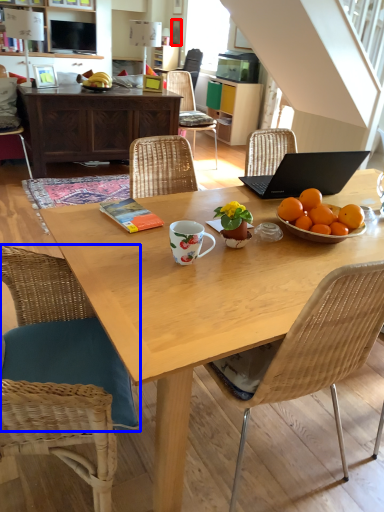
Question: Which object is closer to the camera taking this photo, picture frame (highlighted by a red box) or chair (highlighted by a blue box)?

Choices:
 (A) picture frame
 (B) chair

Answer: (B)